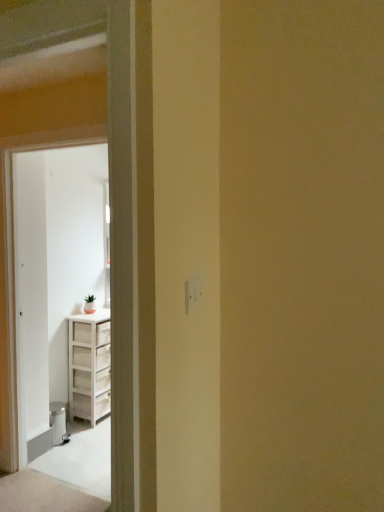
At what (x,y) coordinates should I click in order to perform the action: click on white wood cabinet at left. Please return your answer as a coordinate pair (x, y). The height and width of the screenshot is (512, 384). Looking at the image, I should click on (53, 265).

Describe the element at coordinates (53, 265) in the screenshot. The image size is (384, 512). I see `white wood cabinet at left` at that location.

The width and height of the screenshot is (384, 512). Describe the element at coordinates (31, 305) in the screenshot. I see `white wood screen door at left` at that location.

Where is `white wood screen door at left`? white wood screen door at left is located at coordinates (31, 305).

Locate an element on the screen. The image size is (384, 512). white wood cabinet at left is located at coordinates (53, 265).

Which object is positioned more to the left, white wood screen door at left or white wood cabinet at left?

white wood screen door at left is more to the left.

Which is in front, white wood screen door at left or white wood cabinet at left?

white wood cabinet at left is more forward.

Is point (45, 297) farther from camera compared to point (59, 360)?

That is False.

From the image's perspective, is white wood screen door at left located above or below white wood cabinet at left?

From the image's perspective, white wood screen door at left appears below white wood cabinet at left.

Looking at this image, from a real-world perspective, is white wood screen door at left physically below white wood cabinet at left?

Yes, from a real-world perspective, white wood screen door at left is beneath white wood cabinet at left.

From the picture: Is white wood screen door at left wider than white wood cabinet at left?

No.

Consider the image. Considering the sizes of objects white wood screen door at left and white wood cabinet at left in the image provided, who is taller, white wood screen door at left or white wood cabinet at left?

white wood screen door at left is taller.

Is white wood screen door at left bigger than white wood cabinet at left?

No, white wood screen door at left is not bigger than white wood cabinet at left.

Do you think white wood screen door at left is within white wood cabinet at left, or outside of it?

white wood screen door at left cannot be found inside white wood cabinet at left.

Is white wood screen door at left far away from white wood cabinet at left?

Actually, white wood screen door at left and white wood cabinet at left are a little close together.

Is white wood screen door at left looking in the opposite direction of white wood cabinet at left?

No, white wood screen door at left is not facing away from white wood cabinet at left.

Measure the distance between white wood screen door at left and white wood cabinet at left.

white wood screen door at left and white wood cabinet at left are 9.95 inches apart.

This screenshot has height=512, width=384. I want to click on door in front of the white wood screen door at left, so click(53, 265).

Which is more to the right, white wood cabinet at left or white wood screen door at left?

white wood cabinet at left.

In the image, is white wood cabinet at left positioned in front of or behind white wood screen door at left?

In the image, white wood cabinet at left appears in front of white wood screen door at left.

Is point (30, 275) farther from camera compared to point (29, 155)?

Yes, point (30, 275) is behind point (29, 155).

From the image's perspective, which is above, white wood cabinet at left or white wood screen door at left?

white wood cabinet at left, from the image's perspective.

From a real-world perspective, is white wood cabinet at left positioned under white wood screen door at left based on gravity?

No, from a real-world perspective, white wood cabinet at left is not beneath white wood screen door at left.

Does white wood cabinet at left have a lesser width compared to white wood screen door at left?

No, white wood cabinet at left is not thinner than white wood screen door at left.

Who is taller, white wood cabinet at left or white wood screen door at left?

With more height is white wood screen door at left.

Does white wood cabinet at left have a larger size compared to white wood screen door at left?

Indeed, white wood cabinet at left has a larger size compared to white wood screen door at left.

Is white wood screen door at left inside white wood cabinet at left?

No.

Is white wood cabinet at left in contact with white wood screen door at left?

white wood cabinet at left and white wood screen door at left are not in contact.

Is white wood cabinet at left oriented towards white wood screen door at left?

No, white wood cabinet at left is not oriented towards white wood screen door at left.

How different are the orientations of white wood cabinet at left and white wood screen door at left in degrees?

The facing directions of white wood cabinet at left and white wood screen door at left are 121 degrees apart.

Identify the location of screen door directly beneath the white wood cabinet at left (from a real-world perspective). The width and height of the screenshot is (384, 512). (31, 305).

Where is `door located above the white wood screen door at left (from a real-world perspective)`? This screenshot has width=384, height=512. door located above the white wood screen door at left (from a real-world perspective) is located at coordinates (53, 265).

I want to click on door on the right of white wood screen door at left, so click(53, 265).